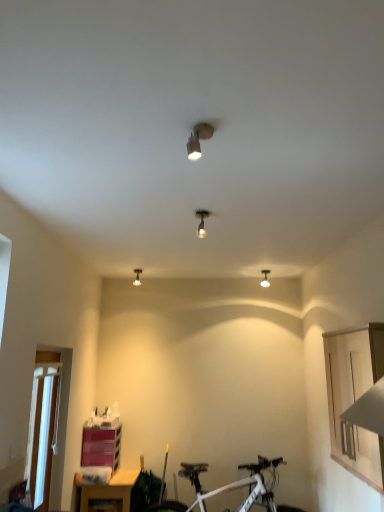
Where is `white matte bicycle at lower center`? This screenshot has height=512, width=384. white matte bicycle at lower center is located at coordinates click(228, 487).

Identify the location of matte silver light fixture at center, positioned as the 2th light fixture in bottom-to-top order. This screenshot has height=512, width=384. (137, 277).

Measure the distance between matte silver spotlight at upper center, the first light fixture from the top, and camera.

The distance of matte silver spotlight at upper center, the first light fixture from the top, from camera is 1.67 meters.

Measure the distance between white plastic window screen at lower left and camera.

The distance of white plastic window screen at lower left from camera is 3.00 meters.

This screenshot has height=512, width=384. Find the location of `matte silver spotlight at center, the 3th light fixture in the left-to-right sequence`. matte silver spotlight at center, the 3th light fixture in the left-to-right sequence is located at coordinates [x=202, y=221].

From a real-world perspective, is matte silver spotlight at center, the third light fixture in the bottom-to-top sequence, physically located above or below matte silver light fixture at center, the 3th light fixture in the top-to-bottom sequence?

From a real-world perspective, matte silver spotlight at center, the third light fixture in the bottom-to-top sequence, is physically below matte silver light fixture at center, the 3th light fixture in the top-to-bottom sequence.

Between matte silver spotlight at center, the 3th light fixture when ordered from back to front, and matte silver light fixture at center, positioned as the 4th light fixture in right-to-left order, which one has larger width?

With larger width is matte silver spotlight at center, the 3th light fixture when ordered from back to front.

In the scene shown: Looking at the image, does matte silver spotlight at center, the third light fixture in the bottom-to-top sequence, seem bigger or smaller compared to matte silver light fixture at center, which is counted as the 1th light fixture, starting from the back?

In the image, matte silver spotlight at center, the third light fixture in the bottom-to-top sequence, appears to be larger than matte silver light fixture at center, which is counted as the 1th light fixture, starting from the back.

Between point (198, 230) and point (134, 269), which one is positioned behind?

Point (134, 269)

Who is bigger, matte silver spotlight at center, positioned as the second light fixture in top-to-bottom order, or white matte bicycle at lower center?

white matte bicycle at lower center is bigger.

Is point (203, 229) positioned in front of point (242, 485)?

Yes, it is.

From the image's perspective, relative to white matte bicycle at lower center, is matte silver spotlight at center, the second light fixture positioned from the right, above or below?

Based on their image positions, matte silver spotlight at center, the second light fixture positioned from the right, is located above white matte bicycle at lower center.

How much distance is there between matte silver spotlight at center, the second light fixture positioned from the right, and white matte bicycle at lower center?

They are 2.66 meters apart.

Consider the image. How many degrees apart are the facing directions of matte white light fixture at upper center, marked as the 2th light fixture in a back-to-front arrangement, and matte silver spotlight at upper center, which ranks as the fourth light fixture in back-to-front order?

They differ by 180 degrees in their facing directions.

Is matte white light fixture at upper center, the 4th light fixture positioned from the top, further to the viewer compared to matte silver spotlight at upper center, which ranks as the fourth light fixture in back-to-front order?

Yes, it is behind matte silver spotlight at upper center, which ranks as the fourth light fixture in back-to-front order.

Is matte white light fixture at upper center, the 4th light fixture positioned from the top, next to matte silver spotlight at upper center, the 1th light fixture positioned from the front?

No, matte white light fixture at upper center, the 4th light fixture positioned from the top, is not with matte silver spotlight at upper center, the 1th light fixture positioned from the front.

Find the location of a particular element. The width and height of the screenshot is (384, 512). window screen that is below the matte silver spotlight at center, the 3th light fixture in the left-to-right sequence (from the image's perspective) is located at coordinates (42, 433).

Between matte silver spotlight at center, the second light fixture when ordered from front to back, and white plastic window screen at lower left, which one appears on the left side from the viewer's perspective?

From the viewer's perspective, white plastic window screen at lower left appears more on the left side.

Between matte silver spotlight at center, the 3th light fixture when ordered from back to front, and white plastic window screen at lower left, which one has less height?

matte silver spotlight at center, the 3th light fixture when ordered from back to front.

Is matte silver spotlight at center, the 3th light fixture when ordered from back to front, far from white plastic window screen at lower left?

matte silver spotlight at center, the 3th light fixture when ordered from back to front, is far away from white plastic window screen at lower left.

From the image's perspective, does white matte bicycle at lower center appear higher than matte silver light fixture at center, the 3th light fixture in the top-to-bottom sequence?

No, from the image's perspective, white matte bicycle at lower center is not over matte silver light fixture at center, the 3th light fixture in the top-to-bottom sequence.

Who is smaller, white matte bicycle at lower center or matte silver light fixture at center, positioned as the 2th light fixture in bottom-to-top order?

matte silver light fixture at center, positioned as the 2th light fixture in bottom-to-top order, is smaller.

Would you say white matte bicycle at lower center contains matte silver light fixture at center, acting as the first light fixture starting from the left?

No, matte silver light fixture at center, acting as the first light fixture starting from the left, is not inside white matte bicycle at lower center.

From a real-world perspective, which object stands above the other?

matte silver spotlight at upper center, the fourth light fixture ordered from the bottom, from a real-world perspective.

Considering the positions of objects matte silver spotlight at upper center, the fourth light fixture ordered from the bottom, and matte silver spotlight at center, the 3th light fixture when ordered from back to front, in the image provided, who is behind, matte silver spotlight at upper center, the fourth light fixture ordered from the bottom, or matte silver spotlight at center, the 3th light fixture when ordered from back to front,?

matte silver spotlight at center, the 3th light fixture when ordered from back to front.

Considering the relative positions of matte silver spotlight at upper center, the fourth light fixture ordered from the bottom, and matte silver spotlight at center, the 3th light fixture in the left-to-right sequence, in the image provided, is matte silver spotlight at upper center, the fourth light fixture ordered from the bottom, to the right of matte silver spotlight at center, the 3th light fixture in the left-to-right sequence, from the viewer's perspective?

No, matte silver spotlight at upper center, the fourth light fixture ordered from the bottom, is not to the right of matte silver spotlight at center, the 3th light fixture in the left-to-right sequence.

From a real-world perspective, is pink plastic shelf at lower left located beneath matte white light fixture at upper center, marked as the 2th light fixture in a back-to-front arrangement?

Yes.

Which of these two, pink plastic shelf at lower left or matte white light fixture at upper center, the first light fixture in the bottom-to-top sequence, stands shorter?

With less height is matte white light fixture at upper center, the first light fixture in the bottom-to-top sequence.

Is pink plastic shelf at lower left facing away from matte white light fixture at upper center, placed as the fourth light fixture when sorted from left to right?

pink plastic shelf at lower left does not have its back to matte white light fixture at upper center, placed as the fourth light fixture when sorted from left to right.

Measure the distance from pink plastic shelf at lower left to matte white light fixture at upper center, placed as the fourth light fixture when sorted from left to right.

pink plastic shelf at lower left is 2.30 meters from matte white light fixture at upper center, placed as the fourth light fixture when sorted from left to right.

The height and width of the screenshot is (512, 384). What are the coordinates of `light fixture that is the 1st one when counting downward from the matte silver spotlight at center, the 3th light fixture when ordered from back to front (from the image's perspective)` in the screenshot? It's located at (137, 277).

Locate an element on the screen. This screenshot has height=512, width=384. bicycle behind the matte silver spotlight at center, the third light fixture in the bottom-to-top sequence is located at coordinates (228, 487).

Looking at the image, which one is located closer to matte silver spotlight at center, the 3th light fixture in the left-to-right sequence, white plastic window screen at lower left or matte wood table at lower left?

The object closer to matte silver spotlight at center, the 3th light fixture in the left-to-right sequence, is white plastic window screen at lower left.

Considering their positions, is pink plastic shelf at lower left positioned further to matte silver spotlight at upper center, the first light fixture from the top, than matte silver spotlight at center, the 3th light fixture in the left-to-right sequence?

The object further to matte silver spotlight at upper center, the first light fixture from the top, is pink plastic shelf at lower left.

Which object lies nearer to the anchor point matte white light fixture at upper center, arranged as the first light fixture when viewed from the right, white matte bicycle at lower center or pink plastic shelf at lower left?

white matte bicycle at lower center lies closer to matte white light fixture at upper center, arranged as the first light fixture when viewed from the right, than the other object.

Estimate the real-world distances between objects in this image. Which object is closer to matte silver spotlight at center, the 3th light fixture when ordered from back to front, pink plastic shelf at lower left or matte silver light fixture at center, acting as the first light fixture starting from the left?

matte silver light fixture at center, acting as the first light fixture starting from the left, lies closer to matte silver spotlight at center, the 3th light fixture when ordered from back to front, than the other object.

Estimate the real-world distances between objects in this image. Which object is closer to matte white light fixture at upper center, arranged as the third light fixture when viewed from the front, white plastic window screen at lower left or matte silver spotlight at center, the third light fixture in the bottom-to-top sequence?

matte silver spotlight at center, the third light fixture in the bottom-to-top sequence, is closer to matte white light fixture at upper center, arranged as the third light fixture when viewed from the front.

Which object lies further to the anchor point matte silver spotlight at upper center, the first light fixture from the top, white matte bicycle at lower center or pink plastic shelf at lower left?

The object further to matte silver spotlight at upper center, the first light fixture from the top, is white matte bicycle at lower center.

Estimate the real-world distances between objects in this image. Which object is closer to matte silver spotlight at center, the 3th light fixture in the left-to-right sequence, matte white light fixture at upper center, arranged as the first light fixture when viewed from the right, or pink plastic shelf at lower left?

Based on the image, matte white light fixture at upper center, arranged as the first light fixture when viewed from the right, appears to be nearer to matte silver spotlight at center, the 3th light fixture in the left-to-right sequence.

Looking at the image, which one is located further to matte silver spotlight at center, the third light fixture in the bottom-to-top sequence, white matte bicycle at lower center or white plastic window screen at lower left?

white matte bicycle at lower center is further to matte silver spotlight at center, the third light fixture in the bottom-to-top sequence.

Identify the location of window screen between matte silver spotlight at center, the 3th light fixture in the left-to-right sequence, and pink plastic shelf at lower left, in the vertical direction. (42, 433).

Find the location of a particular element. The width and height of the screenshot is (384, 512). shelf between matte silver spotlight at upper center, the 1th light fixture positioned from the front, and white matte bicycle at lower center from top to bottom is located at coordinates (101, 447).

At what (x,y) coordinates should I click in order to perform the action: click on light fixture between matte silver light fixture at center, the 3th light fixture in the top-to-bottom sequence, and matte wood table at lower left vertically. Please return your answer as a coordinate pair (x, y). Image resolution: width=384 pixels, height=512 pixels. Looking at the image, I should click on (265, 279).

The width and height of the screenshot is (384, 512). Identify the location of light fixture between matte silver spotlight at center, positioned as the second light fixture in top-to-bottom order, and matte silver light fixture at center, which is counted as the 1th light fixture, starting from the back, from front to back. (265, 279).